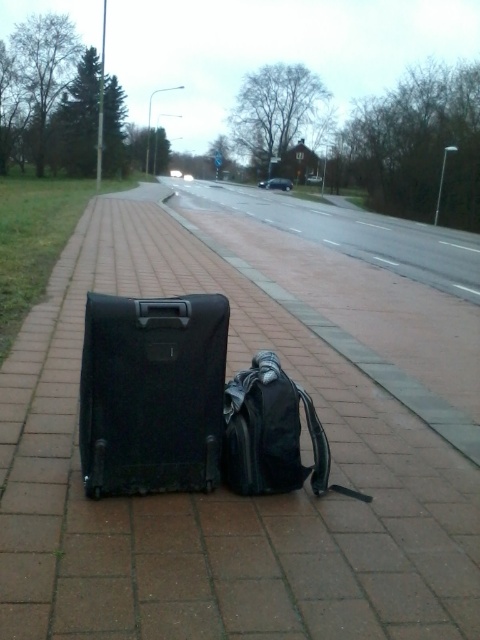
You are standing at point (248, 396) and want to walk to point (167, 396). Which direction should you move relative to your current position?

You should move forward because point (167, 396) is in front of point (248, 396).

Based on the photo, you are a delivery person who needs to stack the black plastic suitcase at center and the black matte suitcase at center vertically. Which one should you place at the bottom to ensure stability?

The black plastic suitcase at center is much taller than the black matte suitcase at center, so placing the taller one at the bottom would provide a more stable base for stacking.

You are standing on the sidewalk and want to pick up both the black matte suitcase at center and the matte black backpack at center. Which one should you reach for first to grab the one closer to you?

The black matte suitcase at center is closer to the viewer than the matte black backpack at center, so you should reach for the black matte suitcase at center first.